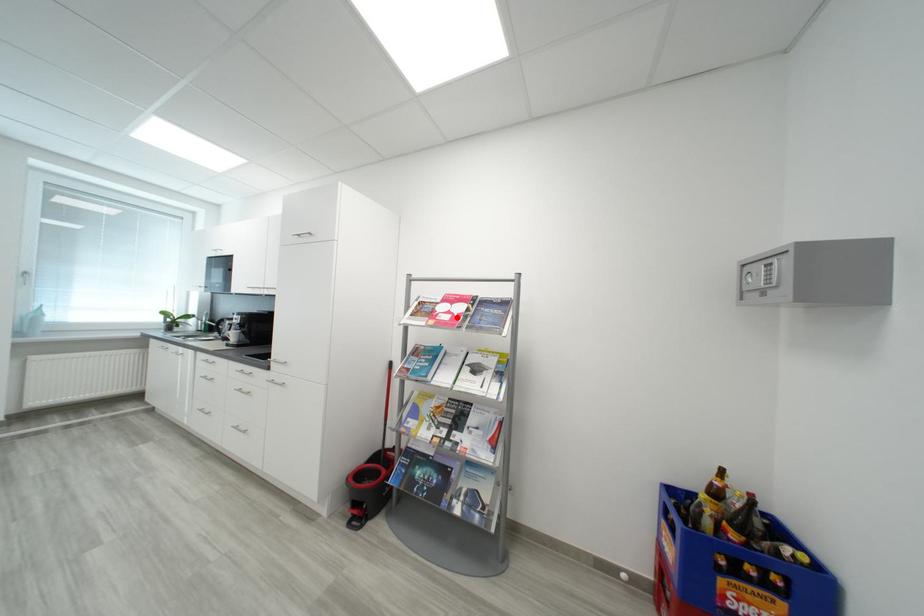
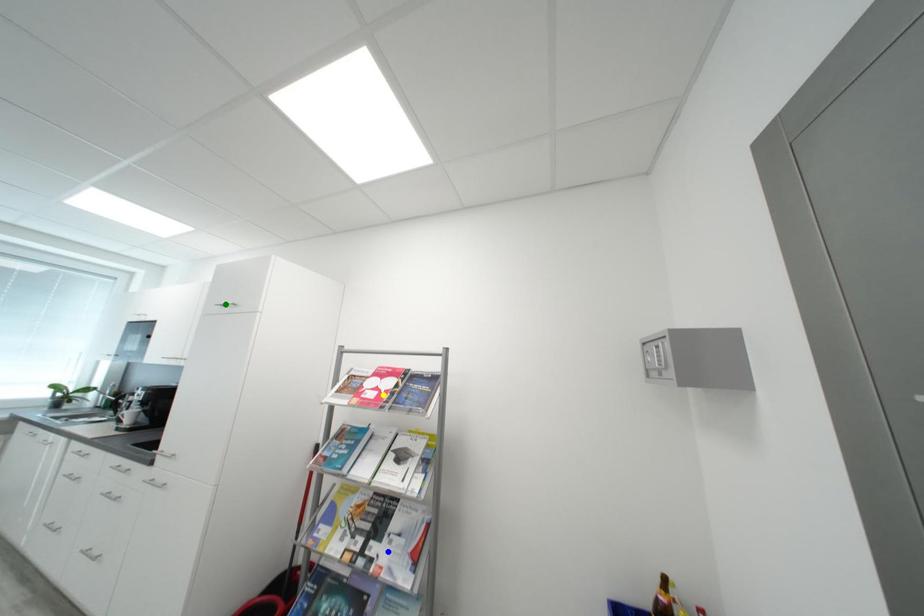
Question: I am providing you with two images of the same scene from different viewpoints. A red point is marked on the first image. You are given multiple points on the second image. Can you choose the point in image 2 that corresponds to the point in image 1?

Choices:
 (A) green point
 (B) blue point
 (C) yellow point

Answer: (C)